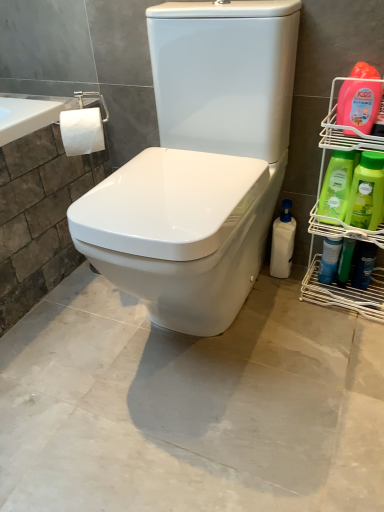
In order to face green plastic bottles at right, placed as the second cleaning product when sorted from left to right, should I rotate leftwards or rightwards?

It's best to rotate right around 19.012 degrees.

At what (x,y) coordinates should I click in order to perform the action: click on white matte toilet paper at upper left. Please return your answer as a coordinate pair (x, y). The height and width of the screenshot is (512, 384). Looking at the image, I should click on (82, 131).

You are a GUI agent. You are given a task and a screenshot of the screen. Output one action in this format:
    pyautogui.click(x=<x>, y=<y>)
    Task: Click on the green matte bottle at right, arranged as the 3th cleaning product when viewed from the right
    
    Given the screenshot: What is the action you would take?
    pyautogui.click(x=367, y=192)

How much space does green matte bottle at right, which is counted as the fourth cleaning product, starting from the left, occupy vertically?

8.80 inches.

Locate an element on the screen. matte orange bottle at right, the third cleaning product from the left is located at coordinates (358, 104).

Describe the element at coordinates (283, 242) in the screenshot. I see `white plastic bottle at lower right, the first cleaning product in the left-to-right sequence` at that location.

Measure the distance between point (x=286, y=232) and camera.

Point (x=286, y=232) is 4.42 feet away from camera.

This screenshot has width=384, height=512. I want to click on green plastic bottles at right, so click(343, 228).

The width and height of the screenshot is (384, 512). I want to click on green plastic bottles at right, placed as the second cleaning product when sorted from left to right, so click(x=337, y=185).

Is blue glossy spray can at lower right thinner than green matte bottle at right, arranged as the 3th cleaning product when viewed from the right?

Indeed, blue glossy spray can at lower right has a lesser width compared to green matte bottle at right, arranged as the 3th cleaning product when viewed from the right.

The height and width of the screenshot is (512, 384). There is a blue glossy spray can at lower right. What are the coordinates of `the 5th cleaning product above it (from a real-world perspective)` in the screenshot? It's located at (367, 192).

Does point (324, 273) come in front of point (356, 179)?

No, it is behind (356, 179).

Considering the sizes of dark blue plastic can at lower right, arranged as the 6th cleaning product when viewed from the left, and matte orange bottle at right, the third cleaning product from the left, in the image, is dark blue plastic can at lower right, arranged as the 6th cleaning product when viewed from the left, wider or thinner than matte orange bottle at right, the third cleaning product from the left,?

In the image, dark blue plastic can at lower right, arranged as the 6th cleaning product when viewed from the left, appears to be more narrow than matte orange bottle at right, the third cleaning product from the left.

Where is `the 4th cleaning product positioned below the matte orange bottle at right, the 4th cleaning product viewed from the right (from a real-world perspective)`? The height and width of the screenshot is (512, 384). the 4th cleaning product positioned below the matte orange bottle at right, the 4th cleaning product viewed from the right (from a real-world perspective) is located at coordinates (363, 264).

Does dark blue plastic can at lower right, arranged as the 6th cleaning product when viewed from the left, have a larger size compared to matte orange bottle at right, the 4th cleaning product viewed from the right?

Actually, dark blue plastic can at lower right, arranged as the 6th cleaning product when viewed from the left, might be smaller than matte orange bottle at right, the 4th cleaning product viewed from the right.

Locate an element on the screen. the 4th cleaning product positioned below the green plastic bottles at right, which ranks as the 5th cleaning product in right-to-left order (from the image's perspective) is located at coordinates (363, 264).

Is green plastic bottles at right, placed as the second cleaning product when sorted from left to right, with dark blue plastic can at lower right, arranged as the 6th cleaning product when viewed from the left?

No.

From a real-world perspective, which is physically below, green plastic bottles at right, which ranks as the 5th cleaning product in right-to-left order, or dark blue plastic can at lower right, acting as the first cleaning product starting from the right?

dark blue plastic can at lower right, acting as the first cleaning product starting from the right, from a real-world perspective.

Which object is further away from the camera taking this photo, green plastic bottles at right, which ranks as the 5th cleaning product in right-to-left order, or dark blue plastic can at lower right, acting as the first cleaning product starting from the right?

Positioned behind is dark blue plastic can at lower right, acting as the first cleaning product starting from the right.

From the image's perspective, is blue glossy spray bottle at right, arranged as the second cleaning product when viewed from the right, above green plastic bottles at right, which ranks as the 5th cleaning product in right-to-left order?

Incorrect, from the image's perspective, blue glossy spray bottle at right, arranged as the second cleaning product when viewed from the right, is lower than green plastic bottles at right, which ranks as the 5th cleaning product in right-to-left order.

Can you tell me how much blue glossy spray bottle at right, arranged as the 5th cleaning product when viewed from the left, and green plastic bottles at right, which ranks as the 5th cleaning product in right-to-left order, differ in facing direction?

The facing directions of blue glossy spray bottle at right, arranged as the 5th cleaning product when viewed from the left, and green plastic bottles at right, which ranks as the 5th cleaning product in right-to-left order, are 1.11 degrees apart.

Does blue glossy spray bottle at right, arranged as the 5th cleaning product when viewed from the left, have a smaller size compared to green plastic bottles at right, which ranks as the 5th cleaning product in right-to-left order?

Yes, blue glossy spray bottle at right, arranged as the 5th cleaning product when viewed from the left, is smaller than green plastic bottles at right, which ranks as the 5th cleaning product in right-to-left order.

Is blue glossy spray bottle at right, arranged as the 5th cleaning product when viewed from the left, beside green plastic bottles at right, placed as the second cleaning product when sorted from left to right?

No, blue glossy spray bottle at right, arranged as the 5th cleaning product when viewed from the left, is not in contact with green plastic bottles at right, placed as the second cleaning product when sorted from left to right.

Which is closer to the camera, (375, 137) or (360, 222)?

The point (375, 137) is closer.

How much distance is there between green plastic bottles at right and green matte bottle at right, which is counted as the fourth cleaning product, starting from the left?

green plastic bottles at right is 13.52 centimeters away from green matte bottle at right, which is counted as the fourth cleaning product, starting from the left.

From the image's perspective, between green plastic bottles at right and green matte bottle at right, arranged as the 3th cleaning product when viewed from the right, who is located below?

green plastic bottles at right.

In the scene shown: Which object is closer to the camera, blue glossy spray bottle at right, arranged as the 5th cleaning product when viewed from the left, or white plastic bottle at lower right, which ranks as the 6th cleaning product in right-to-left order?

Positioned in front is white plastic bottle at lower right, which ranks as the 6th cleaning product in right-to-left order.

Considering the relative sizes of blue glossy spray bottle at right, arranged as the 5th cleaning product when viewed from the left, and white plastic bottle at lower right, which ranks as the 6th cleaning product in right-to-left order, in the image provided, is blue glossy spray bottle at right, arranged as the 5th cleaning product when viewed from the left, bigger than white plastic bottle at lower right, which ranks as the 6th cleaning product in right-to-left order,?

Incorrect, blue glossy spray bottle at right, arranged as the 5th cleaning product when viewed from the left, is not larger than white plastic bottle at lower right, which ranks as the 6th cleaning product in right-to-left order.

Is blue glossy spray bottle at right, arranged as the second cleaning product when viewed from the right, far from white plastic bottle at lower right, the first cleaning product in the left-to-right sequence?

blue glossy spray bottle at right, arranged as the second cleaning product when viewed from the right, is near white plastic bottle at lower right, the first cleaning product in the left-to-right sequence, not far away.

Does blue glossy spray bottle at right, arranged as the 5th cleaning product when viewed from the left, have a greater height compared to white plastic bottle at lower right, the first cleaning product in the left-to-right sequence?

No, blue glossy spray bottle at right, arranged as the 5th cleaning product when viewed from the left, is not taller than white plastic bottle at lower right, the first cleaning product in the left-to-right sequence.

Is dark blue plastic can at lower right, acting as the first cleaning product starting from the right, at the back of white plastic bottle at lower right, the first cleaning product in the left-to-right sequence?

No, white plastic bottle at lower right, the first cleaning product in the left-to-right sequence, is not facing the opposite direction of dark blue plastic can at lower right, acting as the first cleaning product starting from the right.

How many degrees apart are the facing directions of white plastic bottle at lower right, the first cleaning product in the left-to-right sequence, and dark blue plastic can at lower right, acting as the first cleaning product starting from the right?

The angle between the facing direction of white plastic bottle at lower right, the first cleaning product in the left-to-right sequence, and the facing direction of dark blue plastic can at lower right, acting as the first cleaning product starting from the right, is 4.33 degrees.

In the scene shown: Which of these two, white plastic bottle at lower right, the first cleaning product in the left-to-right sequence, or dark blue plastic can at lower right, acting as the first cleaning product starting from the right, stands shorter?

Standing shorter between the two is dark blue plastic can at lower right, acting as the first cleaning product starting from the right.

In terms of width, does white plastic bottle at lower right, which ranks as the 6th cleaning product in right-to-left order, look wider or thinner when compared to dark blue plastic can at lower right, arranged as the 6th cleaning product when viewed from the left?

white plastic bottle at lower right, which ranks as the 6th cleaning product in right-to-left order, is wider than dark blue plastic can at lower right, arranged as the 6th cleaning product when viewed from the left.

Find the location of `bottle that appears on the left of green matte bottle at right, arranged as the 3th cleaning product when viewed from the right`. bottle that appears on the left of green matte bottle at right, arranged as the 3th cleaning product when viewed from the right is located at coordinates tap(329, 260).

Where is `the 4th cleaning product above the dark blue plastic can at lower right, arranged as the 6th cleaning product when viewed from the left (from a real-world perspective)`? the 4th cleaning product above the dark blue plastic can at lower right, arranged as the 6th cleaning product when viewed from the left (from a real-world perspective) is located at coordinates (358, 104).

Considering their positions, is blue glossy spray can at lower right positioned closer to green matte bottle at right, which is counted as the fourth cleaning product, starting from the left, than dark blue plastic can at lower right, arranged as the 6th cleaning product when viewed from the left?

Among the two, blue glossy spray can at lower right is located nearer to green matte bottle at right, which is counted as the fourth cleaning product, starting from the left.

Based on their spatial positions, is green matte bottle at right, arranged as the 3th cleaning product when viewed from the right, or blue glossy spray bottle at right, arranged as the 5th cleaning product when viewed from the left, closer to dark blue plastic can at lower right, arranged as the 6th cleaning product when viewed from the left?

blue glossy spray bottle at right, arranged as the 5th cleaning product when viewed from the left, lies closer to dark blue plastic can at lower right, arranged as the 6th cleaning product when viewed from the left, than the other object.

Which object lies further to the anchor point white matte toilet paper at upper left, green matte bottle at right, which is counted as the fourth cleaning product, starting from the left, or white plastic bottle at lower right, which ranks as the 6th cleaning product in right-to-left order?

Based on the image, green matte bottle at right, which is counted as the fourth cleaning product, starting from the left, appears to be further to white matte toilet paper at upper left.

Looking at the image, which one is located closer to white plastic bottle at lower right, the first cleaning product in the left-to-right sequence, dark blue plastic can at lower right, arranged as the 6th cleaning product when viewed from the left, or green plastic bottles at right?

Among the two, green plastic bottles at right is located nearer to white plastic bottle at lower right, the first cleaning product in the left-to-right sequence.

Looking at this image, when comparing their distances from white plastic bottle at lower right, which ranks as the 6th cleaning product in right-to-left order, does dark blue plastic can at lower right, arranged as the 6th cleaning product when viewed from the left, or blue glossy spray bottle at right, arranged as the 5th cleaning product when viewed from the left, seem closer?

blue glossy spray bottle at right, arranged as the 5th cleaning product when viewed from the left, lies closer to white plastic bottle at lower right, which ranks as the 6th cleaning product in right-to-left order, than the other object.

Looking at the image, which one is located closer to matte orange bottle at right, the third cleaning product from the left, green plastic bottles at right, placed as the second cleaning product when sorted from left to right, or green matte bottle at right, arranged as the 3th cleaning product when viewed from the right?

green matte bottle at right, arranged as the 3th cleaning product when viewed from the right, is closer to matte orange bottle at right, the third cleaning product from the left.

Looking at the image, which one is located closer to green matte bottle at right, which is counted as the fourth cleaning product, starting from the left, blue glossy spray can at lower right or green plastic bottles at right?

green plastic bottles at right is positioned closer to the anchor green matte bottle at right, which is counted as the fourth cleaning product, starting from the left.

From the picture: Estimate the real-world distances between objects in this image. Which object is closer to green plastic bottles at right, which ranks as the 5th cleaning product in right-to-left order, matte orange bottle at right, the third cleaning product from the left, or blue glossy spray bottle at right, arranged as the second cleaning product when viewed from the right?

matte orange bottle at right, the third cleaning product from the left, is closer to green plastic bottles at right, which ranks as the 5th cleaning product in right-to-left order.

Locate an element on the screen. The image size is (384, 512). bottle between white plastic bottle at lower right, the first cleaning product in the left-to-right sequence, and blue glossy spray bottle at right, arranged as the second cleaning product when viewed from the right is located at coordinates (329, 260).

In order to click on shelf located between white matte toilet paper at upper left and green matte bottle at right, arranged as the 3th cleaning product when viewed from the right, in the left-right direction in this screenshot , I will do `click(343, 228)`.

What are the coordinates of `bottle between white matte toilet paper at upper left and green matte bottle at right, which is counted as the fourth cleaning product, starting from the left` in the screenshot? It's located at (329, 260).

Find the location of a particular element. The image size is (384, 512). bottle between matte orange bottle at right, the 4th cleaning product viewed from the right, and blue glossy spray bottle at right, arranged as the 5th cleaning product when viewed from the left, in the up-down direction is located at coordinates (329, 260).